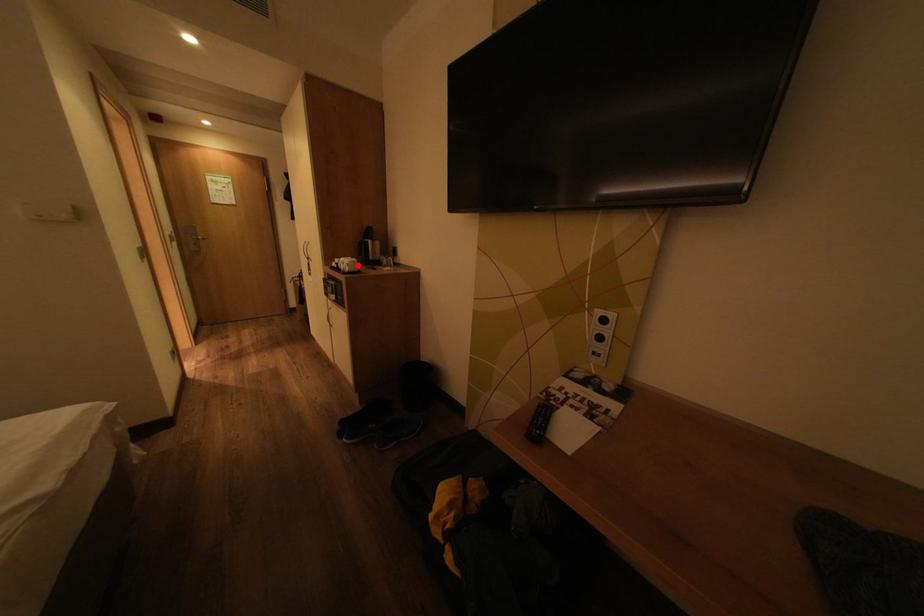
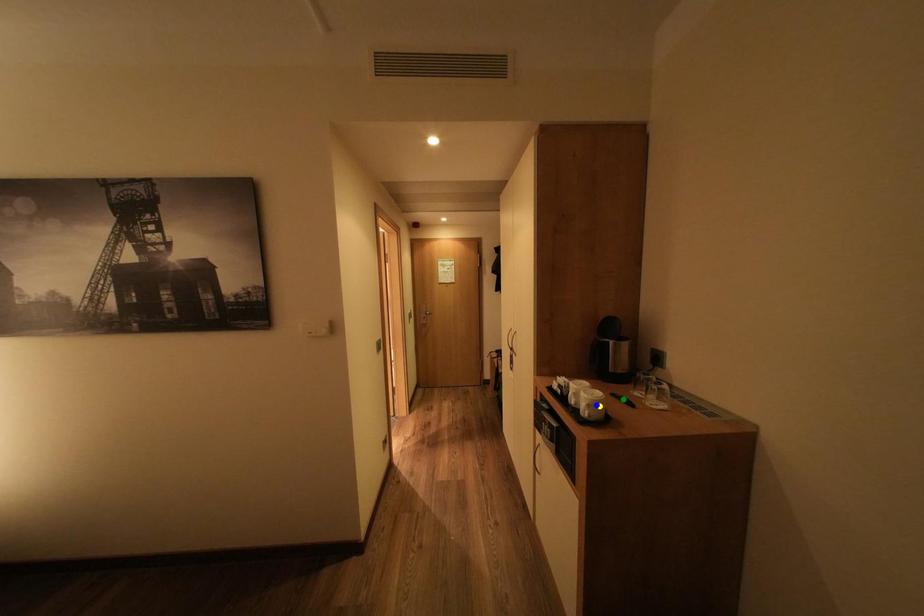
Question: I am providing you with two images of the same scene from different viewpoints. A red point is marked on the first image. You are given multiple points on the second image. In image 2, which mark is for the same physical point as the one in image 1?

Choices:
 (A) yellow point
 (B) blue point
 (C) green point

Answer: (A)